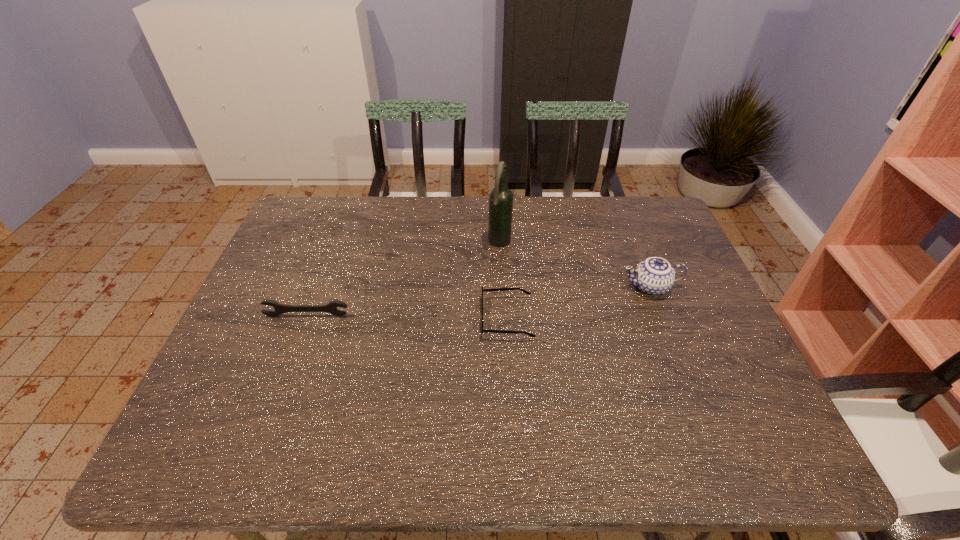
You are a GUI agent. You are given a task and a screenshot of the screen. Output one action in this format:
    pyautogui.click(x=<x>, y=<y>)
    Task: Click on the vacant space situated 0.110m from the spout of the chinaware
    
    Given the screenshot: What is the action you would take?
    pyautogui.click(x=580, y=287)

The width and height of the screenshot is (960, 540). I want to click on free space located on the open ends of the wrench, so click(x=280, y=387).

Identify the location of free space located 0.320m on the front-facing side of the shortest object. (359, 318).

At what (x,y) coordinates should I click in order to perform the action: click on free location located on the front-facing side of the shortest object. Please return your answer as a coordinate pair (x, y). The height and width of the screenshot is (540, 960). Looking at the image, I should click on (351, 318).

Locate an element on the screen. The height and width of the screenshot is (540, 960). free space located 0.230m on the front-facing side of the shortest object is located at coordinates (394, 318).

Where is `object that is at the far edge`? The height and width of the screenshot is (540, 960). object that is at the far edge is located at coordinates (501, 197).

This screenshot has height=540, width=960. Find the location of `object present at the left edge`. object present at the left edge is located at coordinates [x=279, y=308].

Locate an element on the screen. This screenshot has height=540, width=960. object that is at the right edge is located at coordinates (654, 276).

Locate an element on the screen. The image size is (960, 540). vacant space at the far edge of the desktop is located at coordinates (591, 237).

Image resolution: width=960 pixels, height=540 pixels. In the image, there is a desktop. Identify the location of vacant space at the near edge. (437, 433).